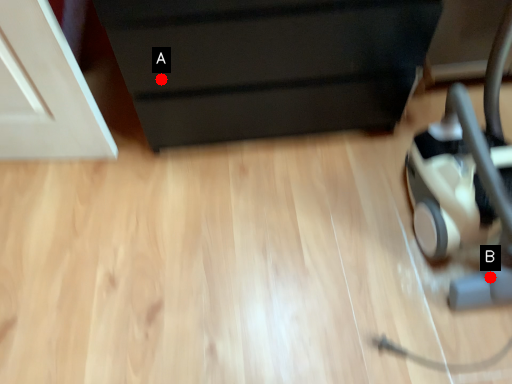
Question: Two points are circled on the image, labeled by A and B beside each circle. Which point is farther to the camera?

Choices:
 (A) A is further
 (B) B is further

Answer: (A)